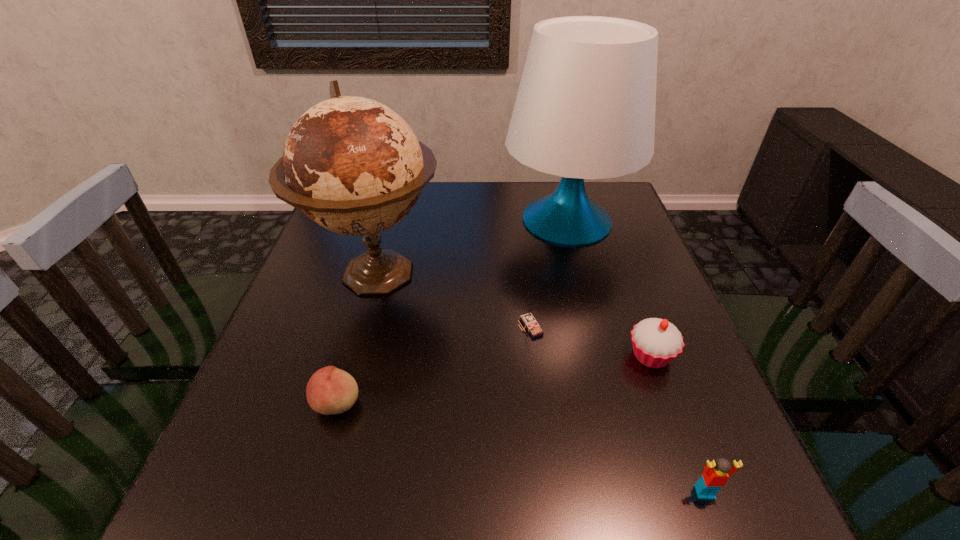
I want to click on blank area at the near right corner, so click(778, 526).

Where is `free spot between the globe and the matchbox`? This screenshot has width=960, height=540. free spot between the globe and the matchbox is located at coordinates (453, 300).

I want to click on blank region between the matchbox and the cupcake, so click(x=590, y=341).

You are a GUI agent. You are given a task and a screenshot of the screen. Output one action in this format:
    pyautogui.click(x=<x>, y=<y>)
    Task: Click on the empty location between the table lamp and the matchbox
    
    Given the screenshot: What is the action you would take?
    pyautogui.click(x=548, y=274)

This screenshot has height=540, width=960. I want to click on free space between the nearest object and the matchbox, so pos(617,409).

Identify the location of free area in between the Lego and the globe. (540, 383).

The image size is (960, 540). What are the coordinates of `free point between the cupcake and the Lego` in the screenshot? It's located at click(x=678, y=424).

In order to click on free spot between the peach and the Lego in this screenshot , I will do `click(521, 448)`.

At what (x,y) coordinates should I click in order to perform the action: click on vacant area that lies between the shortest object and the globe. Please return your answer as a coordinate pair (x, y). Looking at the image, I should click on (356, 338).

The image size is (960, 540). What are the coordinates of `unoccupied position between the Lego and the table lamp` in the screenshot? It's located at (636, 356).